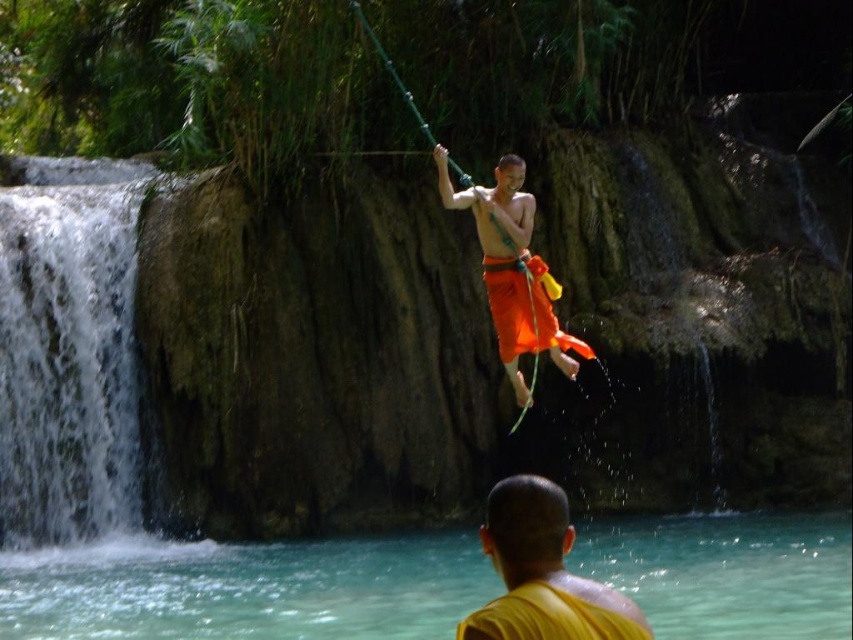
Is point (173, 560) positioned before point (21, 192)?

Yes, it is.

Is clear turquoise water at lower center smaller than white frothy water at left?

Correct, clear turquoise water at lower center occupies less space than white frothy water at left.

Is point (119, 552) positioned behind point (122, 308)?

No, (119, 552) is closer to viewer.

Image resolution: width=853 pixels, height=640 pixels. Identify the location of clear turquoise water at lower center. pos(245,588).

Who is taller, clear turquoise water at lower center or yellow matte monk at lower center?

yellow matte monk at lower center is taller.

Between point (372, 589) and point (479, 634), which one is positioned behind?

Positioned behind is point (372, 589).

This screenshot has height=640, width=853. I want to click on clear turquoise water at lower center, so click(x=245, y=588).

Does yellow matte monk at lower center have a smaller size compared to orange fabric at center?

Actually, yellow matte monk at lower center might be larger than orange fabric at center.

Who is lower down, yellow matte monk at lower center or orange fabric at center?

yellow matte monk at lower center

Describe the element at coordinates (543, 573) in the screenshot. Image resolution: width=853 pixels, height=640 pixels. I see `yellow matte monk at lower center` at that location.

Where is `yellow matte monk at lower center`? Image resolution: width=853 pixels, height=640 pixels. yellow matte monk at lower center is located at coordinates (543, 573).